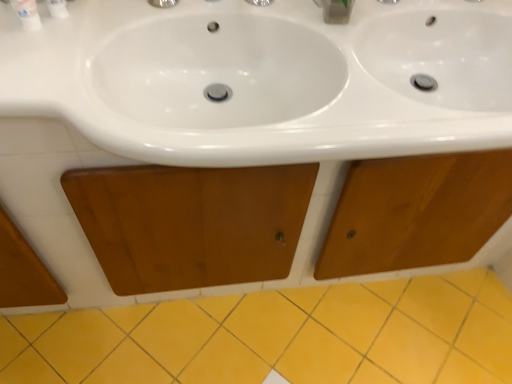
Question: From their relative heights in the image, would you say clear plastic container at upper center is taller or shorter than white glossy bottle at upper left?

Choices:
 (A) tall
 (B) short

Answer: (B)

Question: Based on their positions, is clear plastic container at upper center located to the left or right of white glossy bottle at upper left?

Choices:
 (A) left
 (B) right

Answer: (B)

Question: Estimate the real-world distances between objects in this image. Which object is closer to the yellow ceramic tile at lower center?

Choices:
 (A) clear plastic container at upper center
 (B) white glossy bottle at upper left
 (C) white plastic toothpaste tube at upper left
 (D) wooden cabinet at center

Answer: (D)

Question: Estimate the real-world distances between objects in this image. Which object is farther from the white plastic toothpaste tube at upper left?

Choices:
 (A) yellow ceramic tile at lower center
 (B) wooden cabinet at center
 (C) clear plastic container at upper center
 (D) white glossy bottle at upper left

Answer: (A)